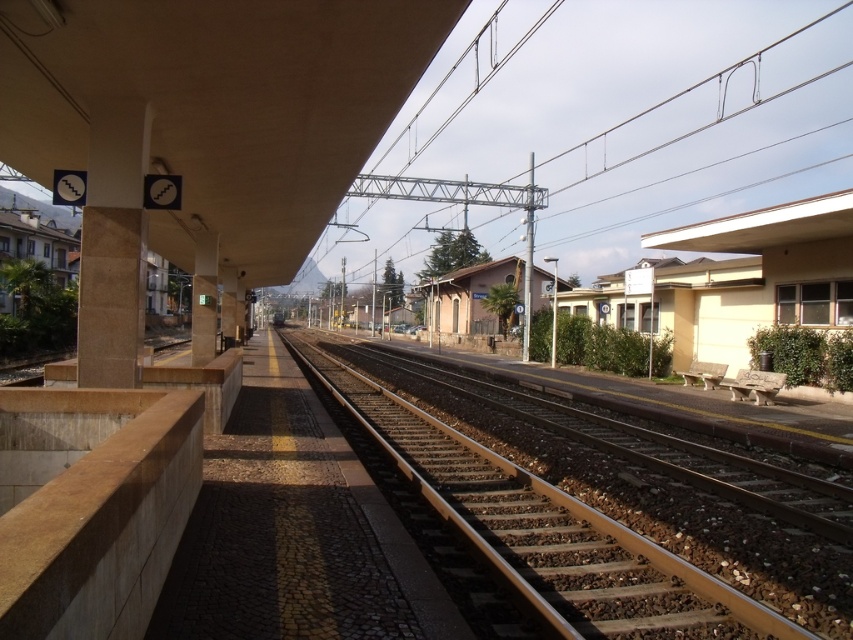
Which is behind, point (733, 627) or point (97, 182)?

Point (97, 182)

Where is `brown gravel track at center`? brown gravel track at center is located at coordinates (543, 525).